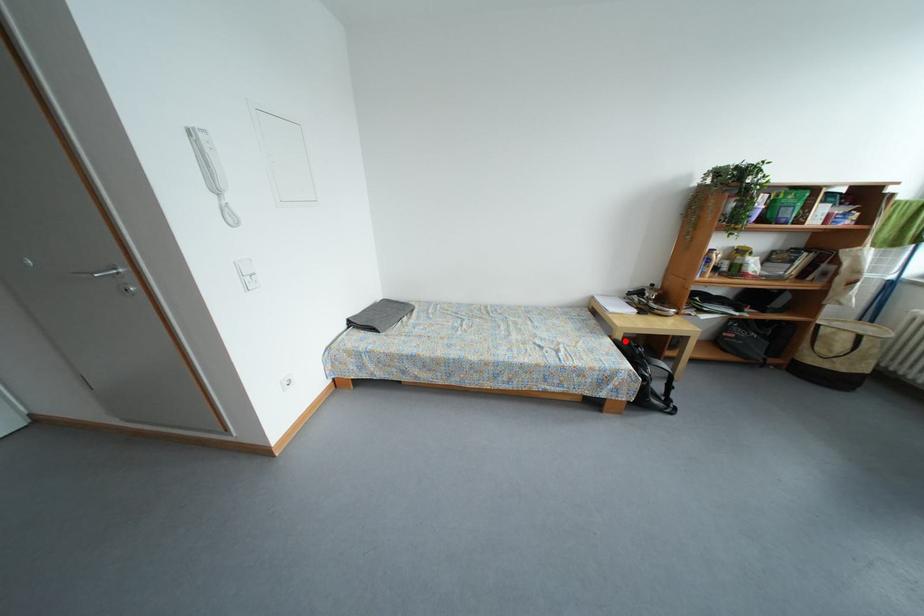
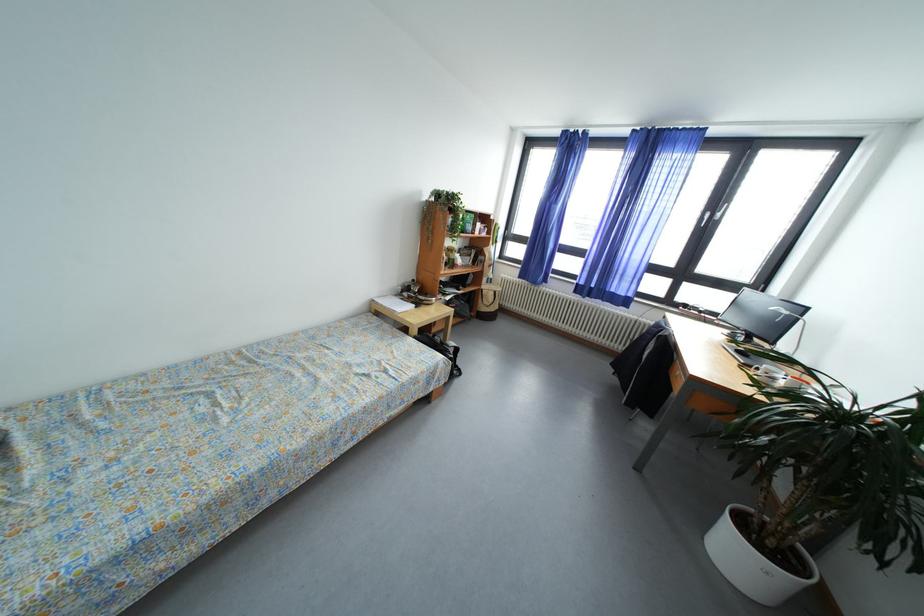
The point at the highlighted location is marked in the first image. Where is the corresponding point in the second image?

(421, 337)